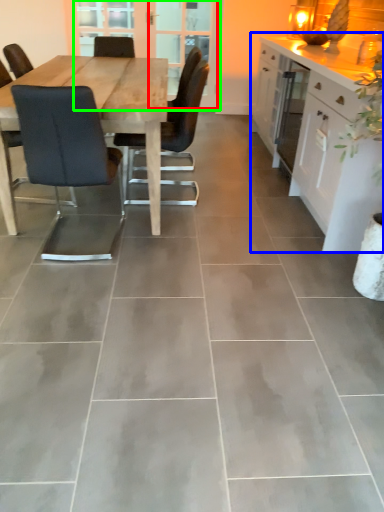
Question: Which is nearer to the screen door (highlighted by a red box)? cabinetry (highlighted by a blue box) or screen door (highlighted by a green box).

Choices:
 (A) cabinetry
 (B) screen door

Answer: (B)